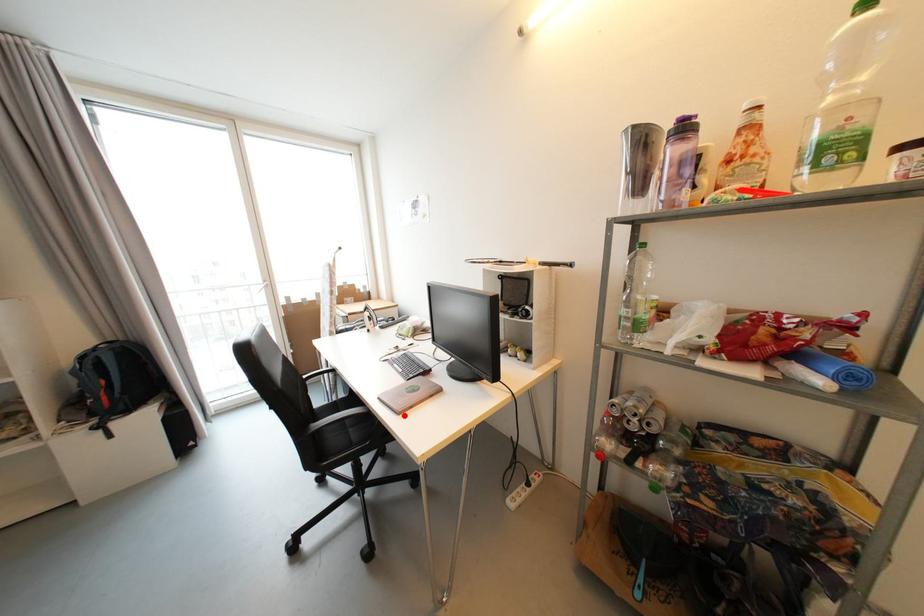
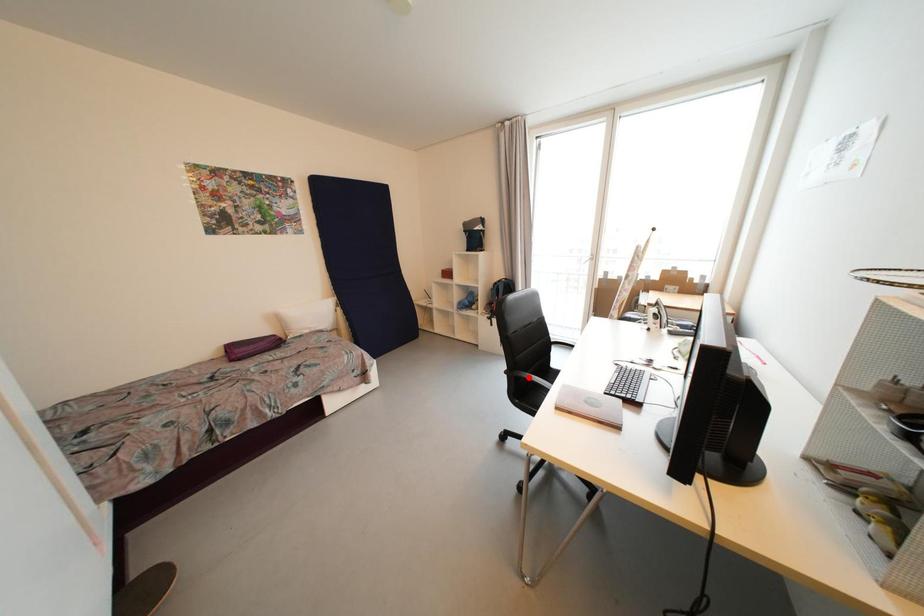
I am providing you with two images of the same scene from different viewpoints. A red point is marked on the first image and another point is marked on the second image. Does the point marked in image1 correspond to the same location as the one in image2?

No